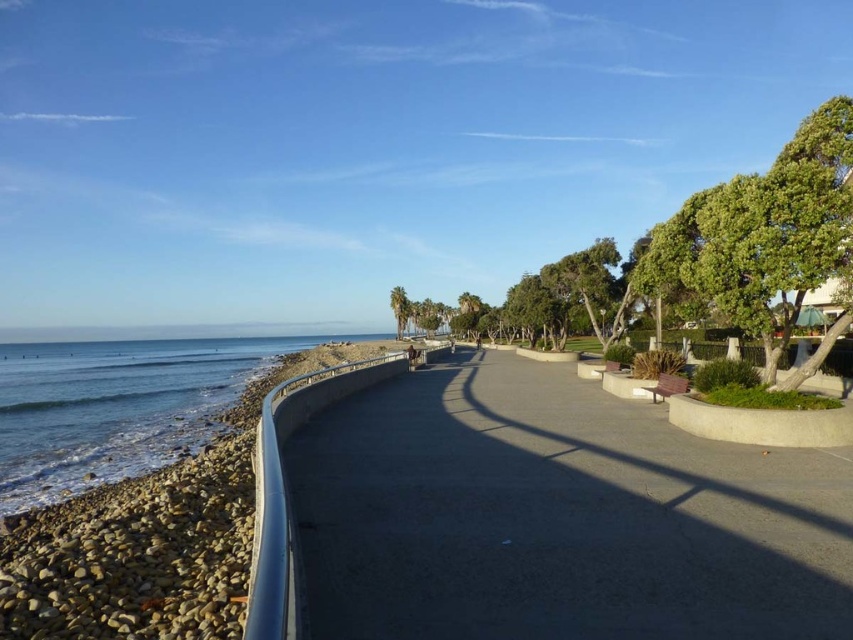
You are a maintenance worker assigned to check the gray concrete pavement at center. You need to walk along the path to inspect each of them. How much distance will you cover if you walk from the first to the last one?

The gray concrete pavement at center are 2.58 meters apart. Since there are two planters, the total distance between the first and last would be 2.58 meters multiplied by the number of intervals between the planters. Assuming there are three planters, the distance would be 2.58 meters multiplied by two intervals, totaling 5.16 meters.

You are a tourist walking along the coastal path and want to take a photo of the blue smooth water at lower left while staying on the gray concrete pavement at center. Which direction should you face to capture the water in your shot?

You should face to the left because the gray concrete pavement at center is to the right of blue smooth water at lower left, meaning the water is located to the left side of the pavement.

You are a gardener who wants to walk from the gray concrete pavement at center to the blue smooth water at lower left. Which path is wider for you to walk on?

The blue smooth water at lower left is wider than the gray concrete pavement at center, so you can walk on the wider path of blue smooth water at lower left.